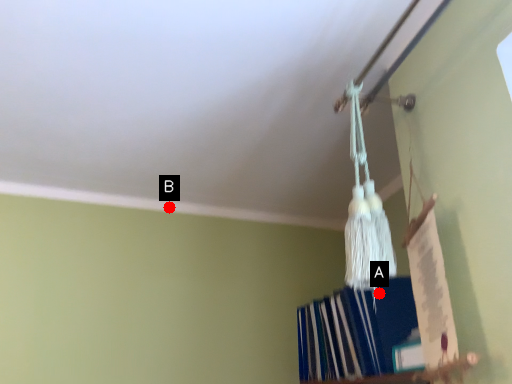
Question: Two points are circled on the image, labeled by A and B beside each circle. Which point is closer to the camera taking this photo?

Choices:
 (A) A is closer
 (B) B is closer

Answer: (A)